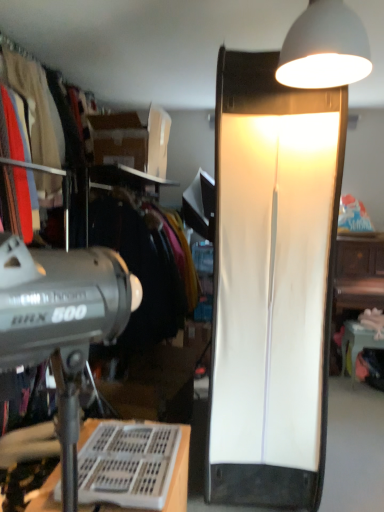
Question: Considering the relative sizes of matte black clothing at upper left, marked as the first clothing in a back-to-front arrangement, and white glossy table at lower right in the image provided, is matte black clothing at upper left, marked as the first clothing in a back-to-front arrangement, bigger than white glossy table at lower right?

Choices:
 (A) yes
 (B) no

Answer: (A)

Question: Is matte black clothing at upper left, marked as the second clothing in a front-to-back arrangement, outside of white glossy table at lower right?

Choices:
 (A) yes
 (B) no

Answer: (A)

Question: Is matte black clothing at upper left, marked as the first clothing in a back-to-front arrangement, to the left of white glossy table at lower right from the viewer's perspective?

Choices:
 (A) yes
 (B) no

Answer: (A)

Question: Is matte black clothing at upper left, marked as the second clothing in a front-to-back arrangement, far from white glossy table at lower right?

Choices:
 (A) no
 (B) yes

Answer: (B)

Question: Considering the relative sizes of matte black clothing at upper left, marked as the second clothing in a front-to-back arrangement, and white glossy table at lower right in the image provided, is matte black clothing at upper left, marked as the second clothing in a front-to-back arrangement, shorter than white glossy table at lower right?

Choices:
 (A) yes
 (B) no

Answer: (B)

Question: Looking at the image, does white matte lampshade at upper right, the second lamp viewed from the top, seem bigger or smaller compared to white matte lampshade at upper right, arranged as the 2th lamp when ordered from the bottom?

Choices:
 (A) small
 (B) big

Answer: (B)

Question: Would you say white matte lampshade at upper right, the 1th lamp when ordered from bottom to top, is to the left or to the right of white matte lampshade at upper right, positioned as the 1th lamp in front-to-back order, in the picture?

Choices:
 (A) right
 (B) left

Answer: (B)

Question: Is white matte lampshade at upper right, the 1th lamp when ordered from bottom to top, in front of or behind white matte lampshade at upper right, positioned as the 1th lamp in front-to-back order, in the image?

Choices:
 (A) front
 (B) behind

Answer: (B)

Question: Does point (264, 174) appear closer or farther from the camera than point (357, 24)?

Choices:
 (A) farther
 (B) closer

Answer: (A)

Question: Do you think white matte lampshade at upper right, arranged as the 2th lamp when ordered from the bottom, is within white plastic desk at lower left, or outside of it?

Choices:
 (A) inside
 (B) outside

Answer: (B)

Question: In terms of size, does white matte lampshade at upper right, arranged as the 2th lamp when ordered from the bottom, appear bigger or smaller than white plastic desk at lower left?

Choices:
 (A) big
 (B) small

Answer: (B)

Question: From the image's perspective, is white matte lampshade at upper right, marked as the second lamp in a back-to-front arrangement, above or below white plastic desk at lower left?

Choices:
 (A) below
 (B) above

Answer: (B)

Question: Is point click(x=354, y=66) closer or farther from the camera than point click(x=9, y=438)?

Choices:
 (A) farther
 (B) closer

Answer: (B)

Question: Is point (46, 183) closer or farther from the camera than point (251, 98)?

Choices:
 (A) farther
 (B) closer

Answer: (A)

Question: From a real-world perspective, is smooth cotton shirt at left, which ranks as the 2th clothing in back-to-front order, physically located above or below white matte lampshade at upper right, the second lamp viewed from the top?

Choices:
 (A) above
 (B) below

Answer: (A)